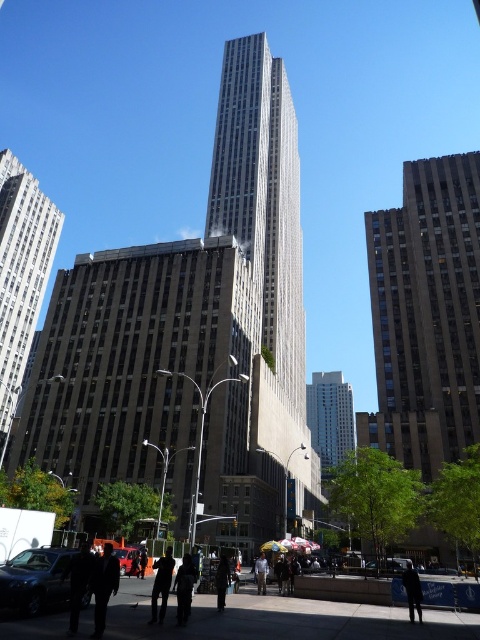
Question: Which point is closer to the camera?

Choices:
 (A) shiny black sedan at lower left
 (B) gray stone skyscraper at left
 (C) white glass building at center

Answer: (A)

Question: Is white glass building at center to the left of metallic silver car at lower center from the viewer's perspective?

Choices:
 (A) no
 (B) yes

Answer: (A)

Question: Does dark gray jacket at lower left lie in front of light brown leather jacket at center?

Choices:
 (A) yes
 (B) no

Answer: (A)

Question: Does dark gray suit at center have a greater width compared to shiny red car at center?

Choices:
 (A) no
 (B) yes

Answer: (A)

Question: Among these points, which one is farthest from the camera?

Choices:
 (A) pos(216,580)
 (B) pos(381,310)
 (C) pos(16,592)

Answer: (B)

Question: Based on their relative distances, which object is farther from the white glass building at center?

Choices:
 (A) smooth gray skyscraper at center
 (B) gray stone skyscraper at left

Answer: (B)